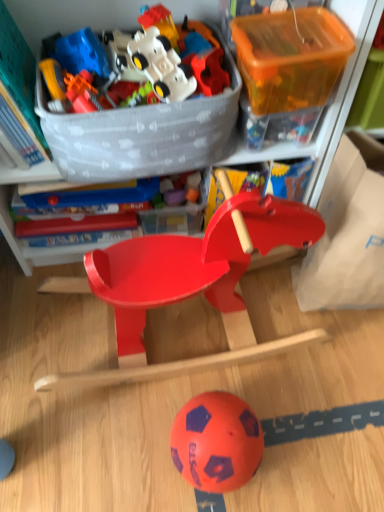
Question: Does matte plastic rocking horse at center lie behind matte plastic rocking horse at center, the 6th toy viewed from the top?

Choices:
 (A) yes
 (B) no

Answer: (B)

Question: Is matte plastic rocking horse at center, marked as the first toy in a bottom-to-top arrangement, completely or partially inside matte plastic rocking horse at center?

Choices:
 (A) no
 (B) yes

Answer: (A)

Question: Is matte plastic rocking horse at center touching matte plastic rocking horse at center, marked as the first toy in a bottom-to-top arrangement?

Choices:
 (A) yes
 (B) no

Answer: (B)

Question: Does matte plastic rocking horse at center appear on the right side of matte plastic rocking horse at center, the 6th toy viewed from the top?

Choices:
 (A) no
 (B) yes

Answer: (A)

Question: Considering the relative sizes of matte plastic rocking horse at center and matte plastic rocking horse at center, marked as the first toy in a bottom-to-top arrangement, in the image provided, is matte plastic rocking horse at center bigger than matte plastic rocking horse at center, marked as the first toy in a bottom-to-top arrangement,?

Choices:
 (A) no
 (B) yes

Answer: (B)

Question: Is matte plastic toy car at upper center, which ranks as the second toy in top-to-bottom order, spatially inside white matte plastic toy car at upper center, the 6th toy positioned from the bottom, or outside of it?

Choices:
 (A) inside
 (B) outside

Answer: (B)

Question: In terms of width, does matte plastic toy car at upper center, which ranks as the second toy in top-to-bottom order, look wider or thinner when compared to white matte plastic toy car at upper center, the 1th toy when ordered from top to bottom?

Choices:
 (A) wide
 (B) thin

Answer: (B)

Question: Considering the positions of matte plastic toy car at upper center, which is the fifth toy in bottom-to-top order, and white matte plastic toy car at upper center, the 1th toy when ordered from top to bottom, in the image, is matte plastic toy car at upper center, which is the fifth toy in bottom-to-top order, taller or shorter than white matte plastic toy car at upper center, the 1th toy when ordered from top to bottom,?

Choices:
 (A) tall
 (B) short

Answer: (B)

Question: Considering their positions, is matte plastic toy car at upper center, which is the fifth toy in bottom-to-top order, located in front of or behind white matte plastic toy car at upper center, the 6th toy positioned from the bottom?

Choices:
 (A) behind
 (B) front

Answer: (A)

Question: From the image's perspective, is translucent orange plastic storage box at upper right, which appears as the 2th storage box when viewed from the left, positioned above or below translucent plastic toy at upper left, which appears as the second toy when ordered from the bottom?

Choices:
 (A) above
 (B) below

Answer: (A)

Question: Is translucent orange plastic storage box at upper right, which ranks as the 2th storage box in right-to-left order, to the left or to the right of translucent plastic toy at upper left, the 5th toy in the top-to-bottom sequence, in the image?

Choices:
 (A) left
 (B) right

Answer: (B)

Question: Is translucent orange plastic storage box at upper right, which appears as the 2th storage box when viewed from the left, wider or thinner than translucent plastic toy at upper left, the 5th toy in the top-to-bottom sequence?

Choices:
 (A) thin
 (B) wide

Answer: (B)

Question: Relative to translucent plastic toy at upper left, which appears as the second toy when ordered from the bottom, is translucent orange plastic storage box at upper right, which appears as the 2th storage box when viewed from the left, in front or behind?

Choices:
 (A) behind
 (B) front

Answer: (B)

Question: From a real-world perspective, is matte plastic toy car at upper center, which is the fifth toy in bottom-to-top order, above or below translucent orange plastic storage box at upper right, which appears as the 2th storage box when viewed from the left?

Choices:
 (A) below
 (B) above

Answer: (B)

Question: Considering their positions, is matte plastic toy car at upper center, which ranks as the second toy in top-to-bottom order, located in front of or behind translucent orange plastic storage box at upper right, which appears as the 2th storage box when viewed from the left?

Choices:
 (A) front
 (B) behind

Answer: (B)